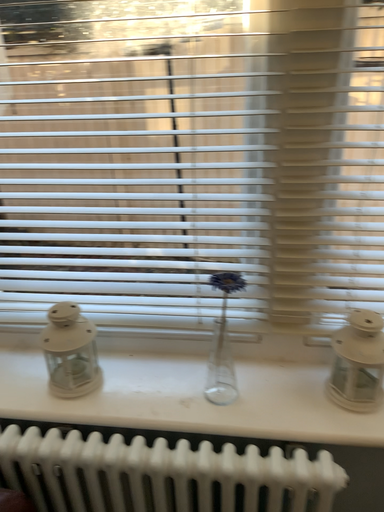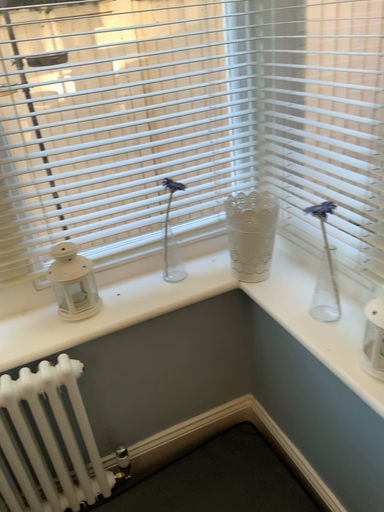
Question: How did the camera likely rotate when shooting the video?

Choices:
 (A) rotated right
 (B) rotated left

Answer: (A)